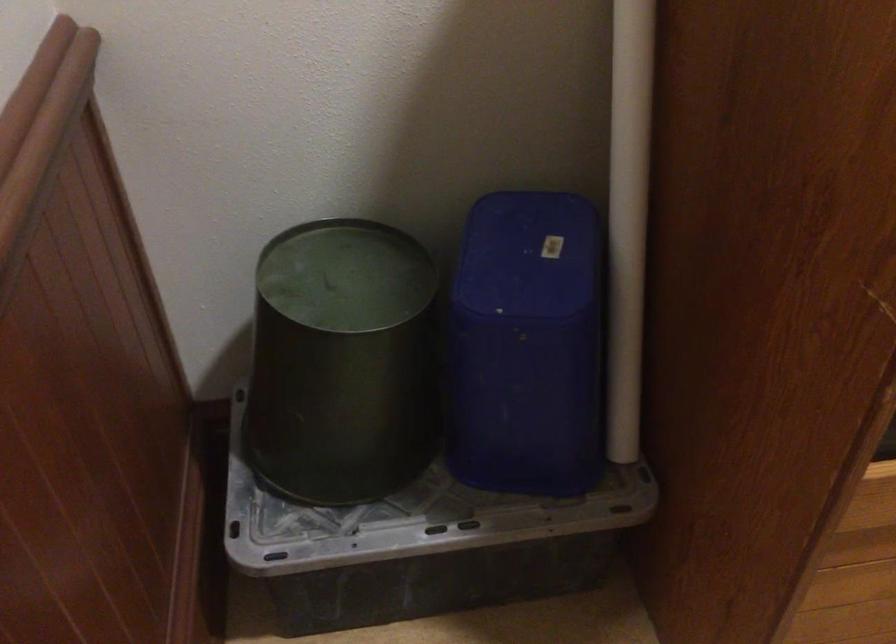
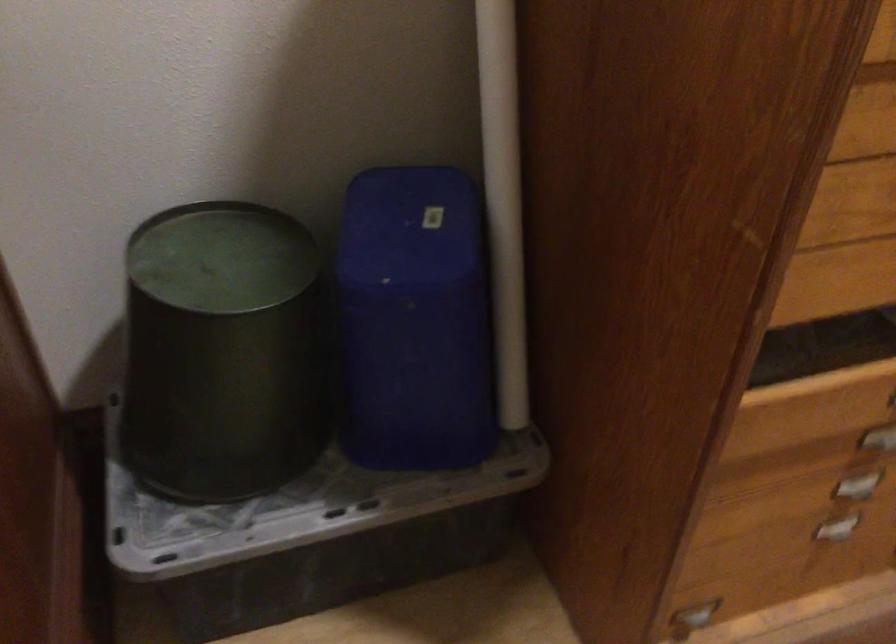
In the second image, find the point that corresponds to [339,370] in the first image.

(222, 352)